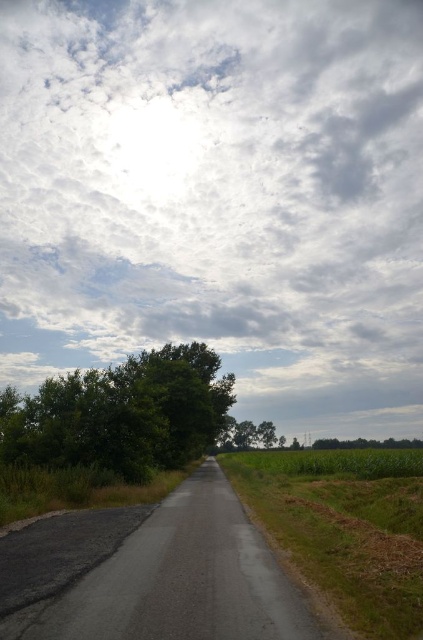
You are standing at the center of the road in the image and want to walk towards the green leafy tree at lower right. Based on the scene description, which direction should you turn to face the tree?

The green leafy tree at lower right is located at point [367,444], which is to the right side of the scene. Since you are standing at the center of the road, you should turn to your right to face the green leafy tree at lower right.

You are a photographer planning to capture the entire cloudy sky at upper center and green leafy tree at left in a single shot. Given that your camera has a fixed horizontal field of view, can you fit both elements into the frame without cropping?

The cloudy sky at upper center is wider than the green leafy tree at left, so yes, both elements can fit into the frame as their widths are compatible with the camera field of view.